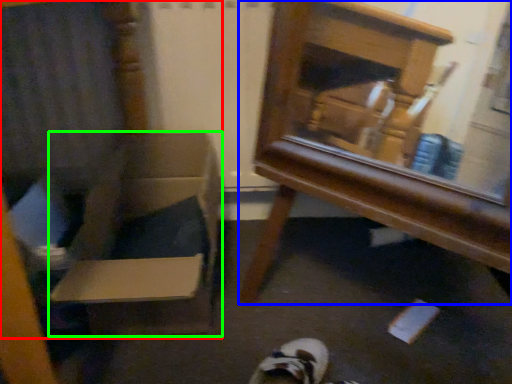
Question: Which object is the farthest from armchair (highlighted by a red box)? Choose among these: furniture (highlighted by a blue box) or cardboard box (highlighted by a green box).

Choices:
 (A) furniture
 (B) cardboard box

Answer: (A)